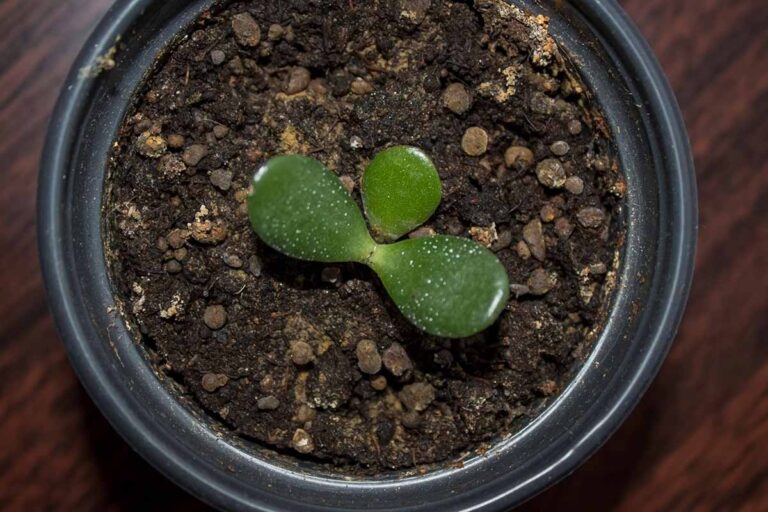
I want to click on pot rim, so click(679, 142).